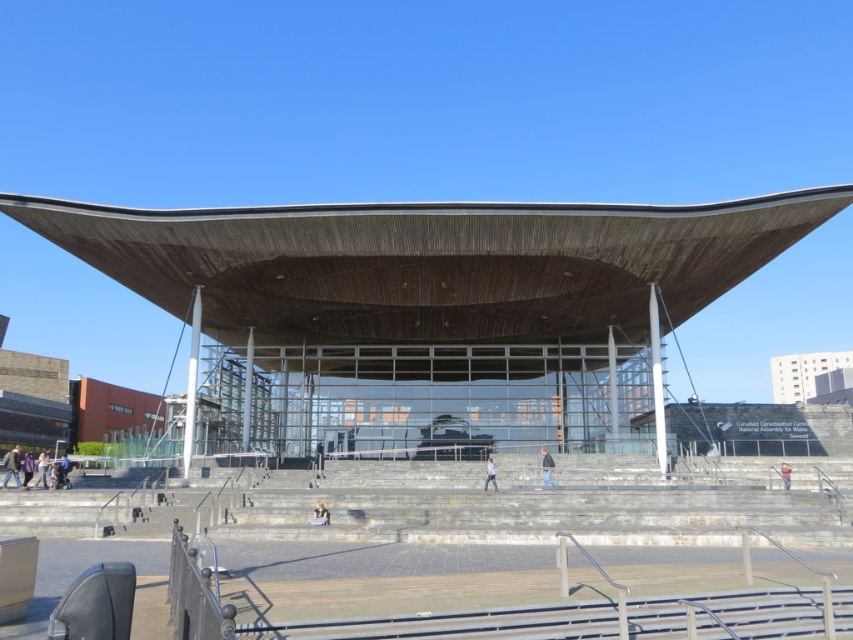
Question: Can you confirm if light brown leather jacket at lower left is smaller than light gray concrete person at center?

Choices:
 (A) no
 (B) yes

Answer: (A)

Question: Is dark gray jacket at lower left smaller than light brown leather jacket at center?

Choices:
 (A) no
 (B) yes

Answer: (A)

Question: Which of these objects is positioned farthest from the light gray concrete person at center?

Choices:
 (A) light brown leather jacket at center
 (B) dark gray concrete person at center

Answer: (B)

Question: Estimate the real-world distances between objects in this image. Which object is farther from the light gray concrete person at center?

Choices:
 (A) wooden canopy at center
 (B) gray fabric jacket at center
 (C) light brown leather jacket at lower left
 (D) light brown leather jacket at center

Answer: (C)

Question: From the image, what is the correct spatial relationship of dark gray jacket at lower left in relation to dark gray concrete person at center?

Choices:
 (A) left
 (B) right

Answer: (A)

Question: Among these points, which one is farthest from the camera?

Choices:
 (A) (326, 518)
 (B) (546, 467)
 (C) (27, 467)
 (D) (18, 472)

Answer: (B)